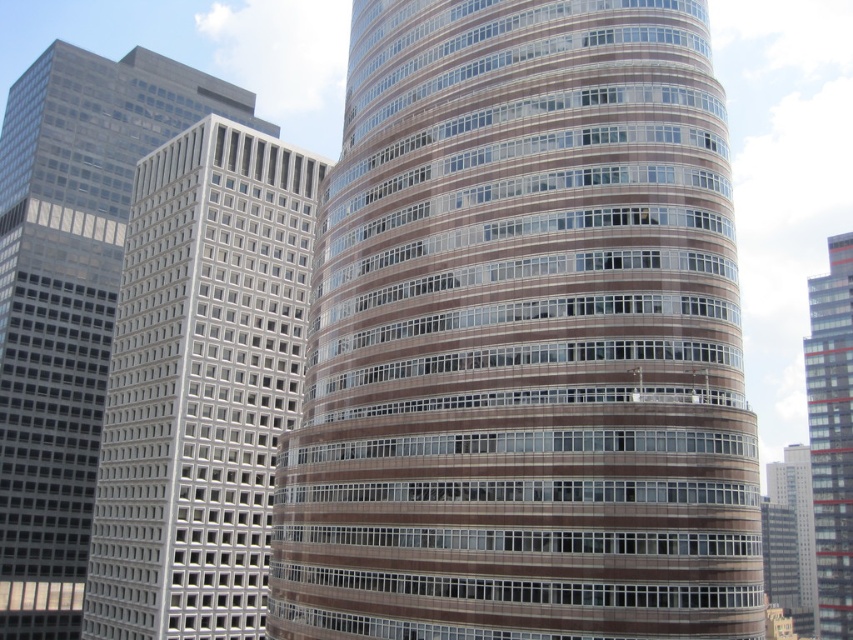
Question: Which point is closer to the camera?

Choices:
 (A) red glass building at right
 (B) white glass building at center
 (C) gray glass skyscraper at right
 (D) brown glass building at center

Answer: (D)

Question: Among these objects, which one is nearest to the camera?

Choices:
 (A) gray glass skyscraper at right
 (B) brown glass building at center
 (C) red glass building at right

Answer: (B)

Question: Can you confirm if brown glass building at center is thinner than red glass building at right?

Choices:
 (A) yes
 (B) no

Answer: (A)

Question: Does brown glass building at center have a smaller size compared to red glass building at right?

Choices:
 (A) no
 (B) yes

Answer: (B)

Question: Which of these objects is positioned closest to the gray glass skyscraper at right?

Choices:
 (A) red glass building at right
 (B) white glass building at center

Answer: (A)

Question: Can you confirm if red glass building at right is bigger than gray glass skyscraper at right?

Choices:
 (A) yes
 (B) no

Answer: (A)